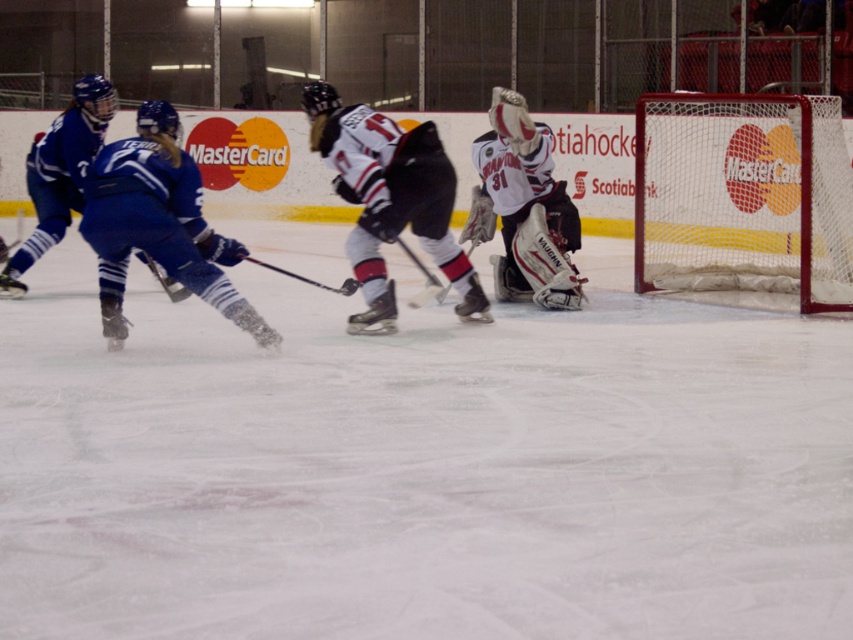
Does matte black hockey stick at left lie in front of metallic silver hockey stick at center?

No, it is behind metallic silver hockey stick at center.

Who is shorter, matte black hockey stick at left or metallic silver hockey stick at center?

Standing shorter between the two is metallic silver hockey stick at center.

Where is `matte black hockey stick at left`? The width and height of the screenshot is (853, 640). matte black hockey stick at left is located at coordinates (165, 280).